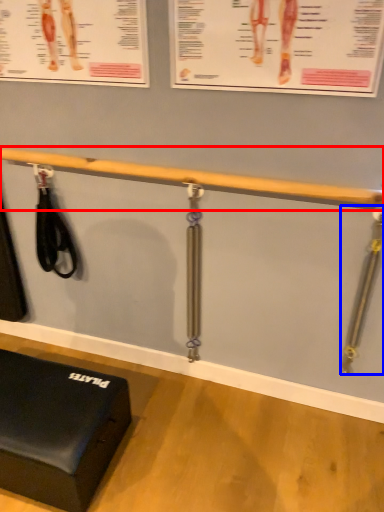
Question: Among these objects, which one is nearest to the camera, beam (highlighted by a red box) or tool (highlighted by a blue box)?

Choices:
 (A) beam
 (B) tool

Answer: (A)